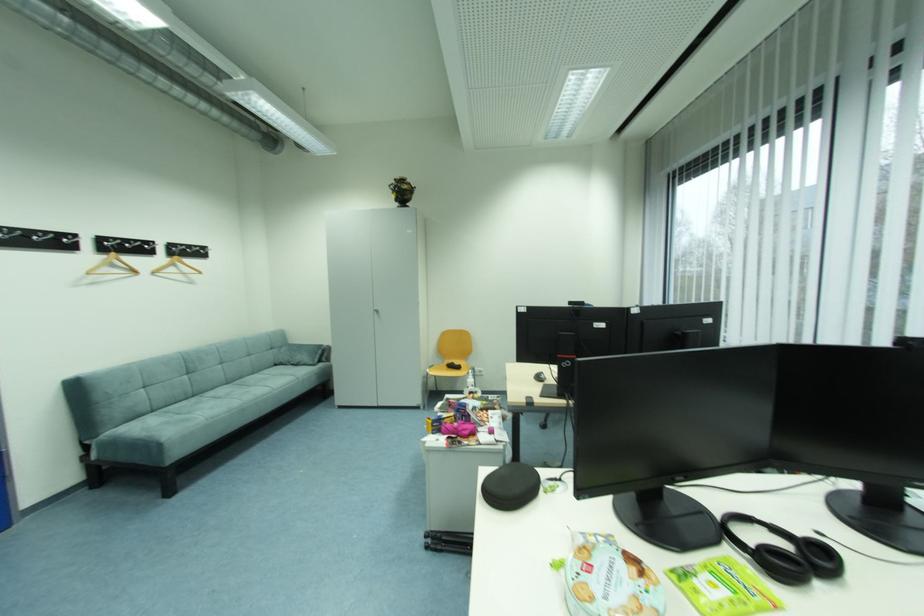
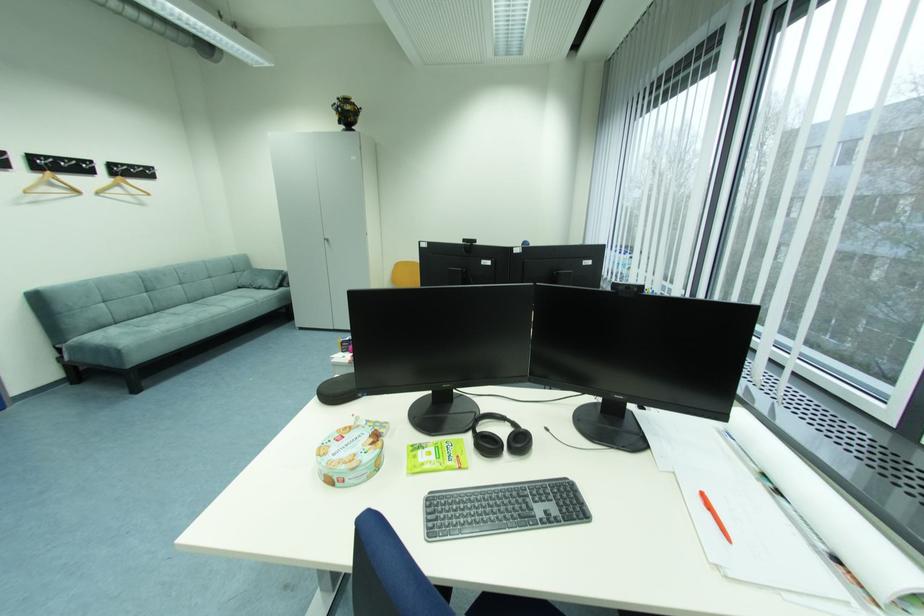
Where in the second image is the point corresponding to [161,274] from the first image?

(104, 193)